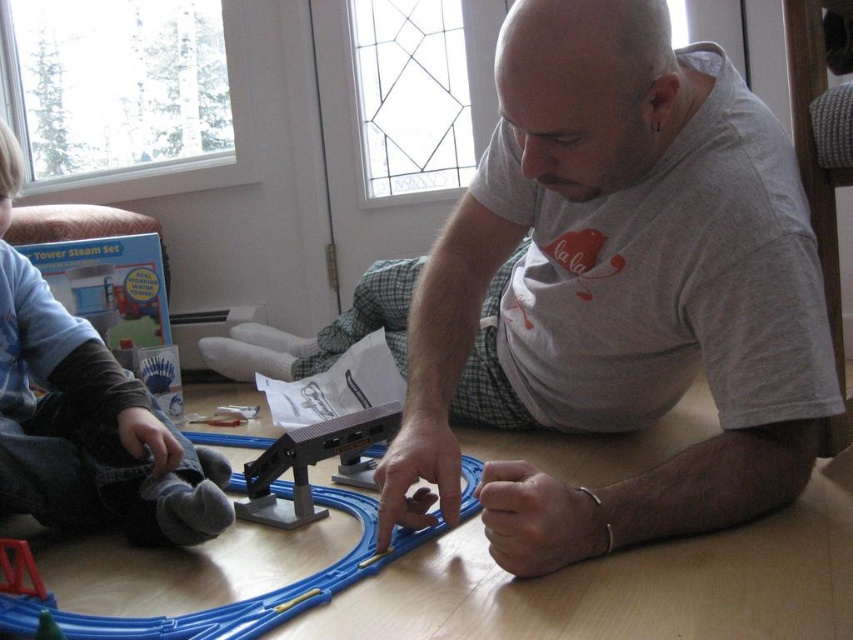
Question: Which of the following is the farthest from the observer?

Choices:
 (A) light blue denim jeans at lower left
 (B) blue plastic track at center
 (C) matte gray shirt at center
 (D) metallic gray track at center

Answer: (D)

Question: Observing the image, what is the correct spatial positioning of matte gray shirt at center in reference to blue plastic track at center?

Choices:
 (A) right
 (B) left

Answer: (A)

Question: Observing the image, what is the correct spatial positioning of matte gray shirt at center in reference to light blue denim jeans at lower left?

Choices:
 (A) right
 (B) left

Answer: (A)

Question: Based on their relative distances, which object is nearer to the light blue denim jeans at lower left?

Choices:
 (A) blue plastic track at center
 (B) matte gray shirt at center
 (C) metallic gray track at center

Answer: (C)

Question: Does blue plastic track at center appear on the right side of metallic gray track at center?

Choices:
 (A) yes
 (B) no

Answer: (B)

Question: Estimate the real-world distances between objects in this image. Which object is closer to the light blue denim jeans at lower left?

Choices:
 (A) metallic gray track at center
 (B) blue plastic track at center
 (C) matte gray shirt at center

Answer: (A)